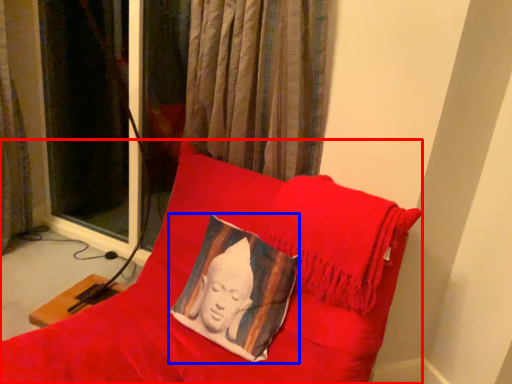
Question: Which object is closer to the camera taking this photo, furniture (highlighted by a red box) or pillow (highlighted by a blue box)?

Choices:
 (A) furniture
 (B) pillow

Answer: (A)